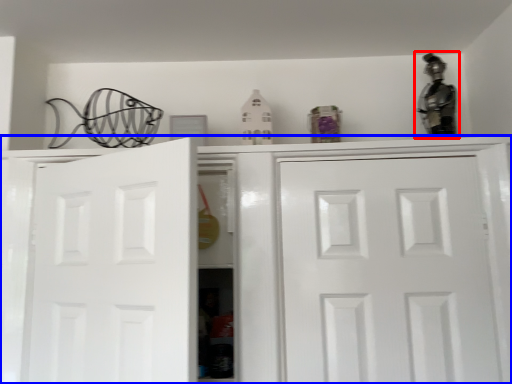
Question: Which object is closer to the camera taking this photo, figurine (highlighted by a red box) or cabinetry (highlighted by a blue box)?

Choices:
 (A) figurine
 (B) cabinetry

Answer: (B)